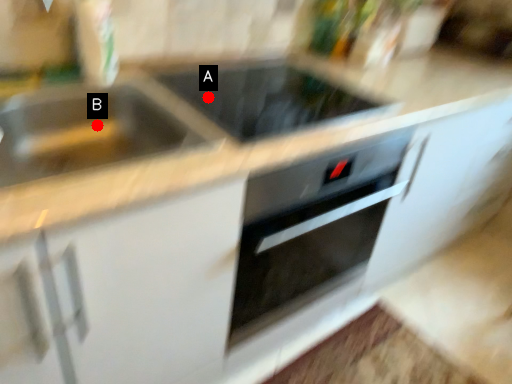
Question: Two points are circled on the image, labeled by A and B beside each circle. Which point appears farthest from the camera in this image?

Choices:
 (A) A is further
 (B) B is further

Answer: (A)